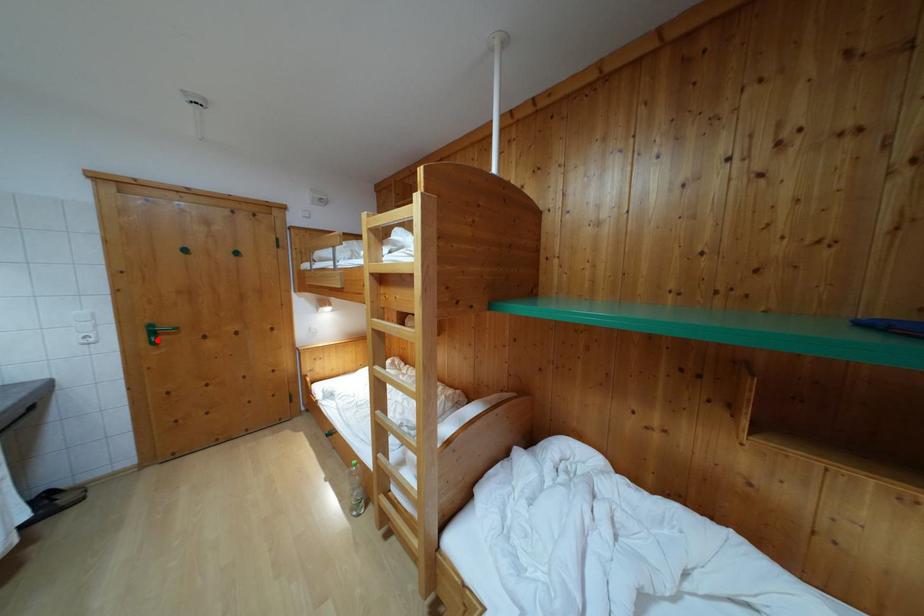
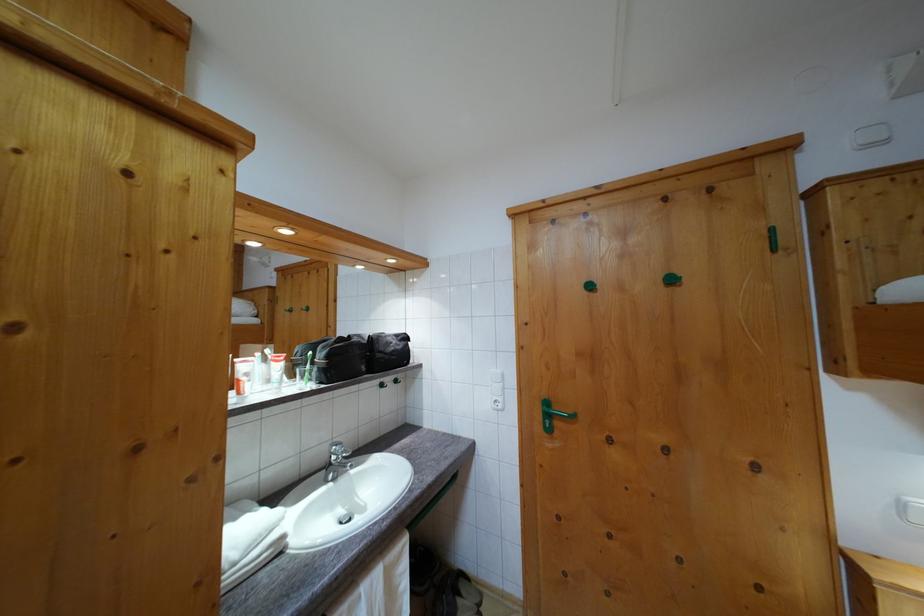
Question: I am providing you with two images of the same scene from different viewpoints. In image1, a red point is highlighted. Considering the same 3D point in image2, which of the following is correct?

Choices:
 (A) It is closer
 (B) It is farther

Answer: (B)